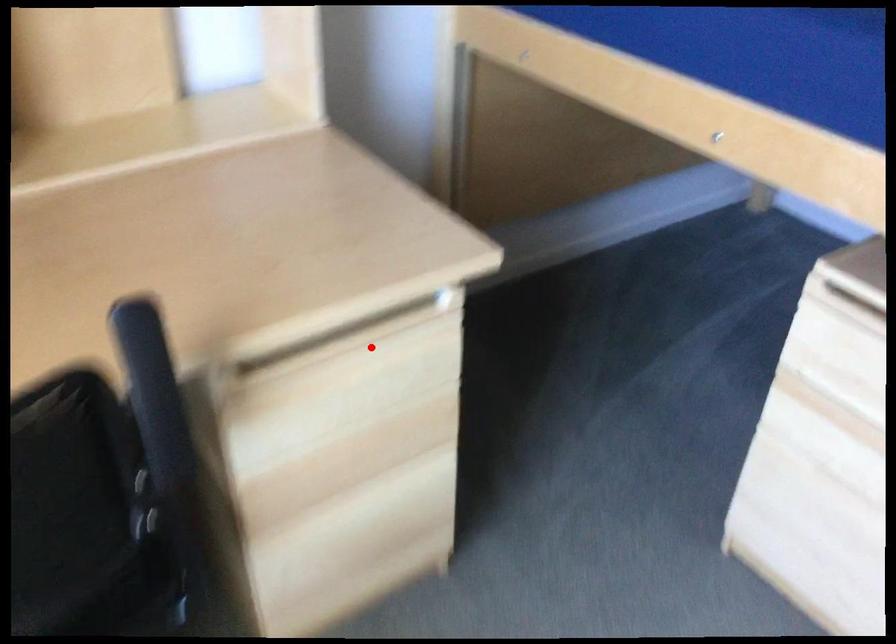
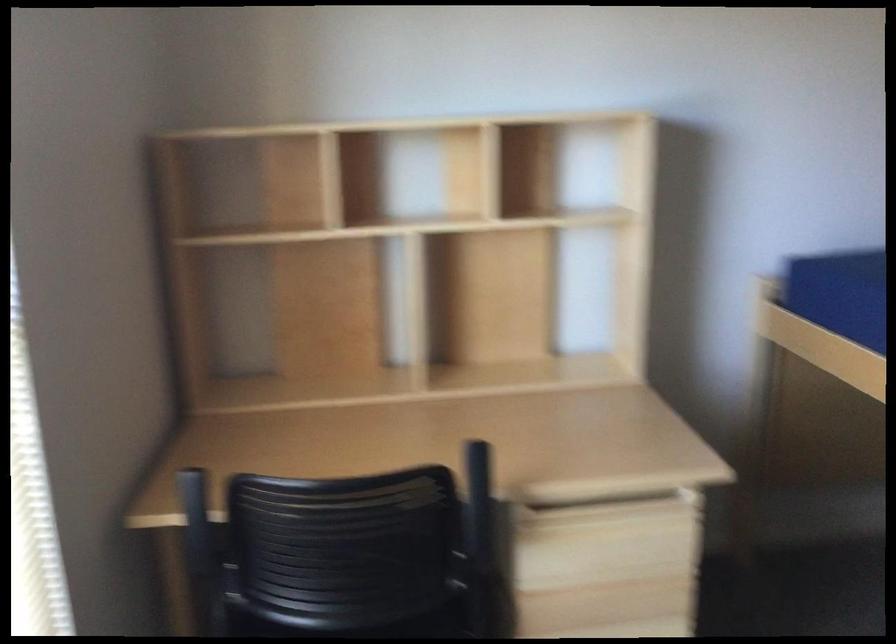
Question: I am providing you with two images of the same scene from different viewpoints. Image1 has a red point marked. In image2, the corresponding 3D location appears at what relative position? Reply with the corresponding letter.

Choices:
 (A) Closer
 (B) Farther

Answer: (B)